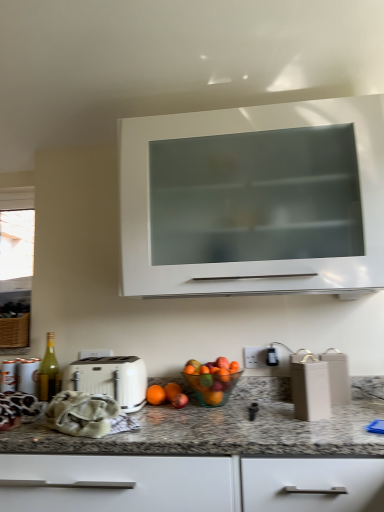
Question: Is green glass bottle at left outside granite at lower center?

Choices:
 (A) no
 (B) yes

Answer: (A)

Question: Is green glass bottle at left closer to the viewer compared to granite at lower center?

Choices:
 (A) yes
 (B) no

Answer: (B)

Question: Is green glass bottle at left oriented away from granite at lower center?

Choices:
 (A) yes
 (B) no

Answer: (B)

Question: Considering the relative sizes of green glass bottle at left and granite at lower center in the image provided, is green glass bottle at left smaller than granite at lower center?

Choices:
 (A) no
 (B) yes

Answer: (B)

Question: Is green glass bottle at left placed right next to granite at lower center?

Choices:
 (A) yes
 (B) no

Answer: (B)

Question: From a real-world perspective, relative to orange matte at center, is white glossy cabinet at upper center vertically above or below?

Choices:
 (A) above
 (B) below

Answer: (A)

Question: Choose the correct answer: Is white glossy cabinet at upper center inside orange matte at center or outside it?

Choices:
 (A) outside
 (B) inside

Answer: (A)

Question: From the image's perspective, is white glossy cabinet at upper center positioned above or below orange matte at center?

Choices:
 (A) below
 (B) above

Answer: (B)

Question: In the image, is white glossy cabinet at upper center on the left side or the right side of orange matte at center?

Choices:
 (A) right
 (B) left

Answer: (A)

Question: Is point (334, 205) closer or farther from the camera than point (34, 500)?

Choices:
 (A) farther
 (B) closer

Answer: (A)

Question: In terms of size, does white glossy cabinet at upper center appear bigger or smaller than granite at lower center?

Choices:
 (A) big
 (B) small

Answer: (B)

Question: In the image, is white glossy cabinet at upper center positioned in front of or behind granite at lower center?

Choices:
 (A) front
 (B) behind

Answer: (B)

Question: Considering the positions of white glossy cabinet at upper center and granite at lower center in the image, is white glossy cabinet at upper center wider or thinner than granite at lower center?

Choices:
 (A) wide
 (B) thin

Answer: (B)

Question: Considering their positions, is matte beige container at lower right located in front of or behind orange matte at center?

Choices:
 (A) front
 (B) behind

Answer: (A)

Question: Looking at their shapes, would you say matte beige container at lower right is wider or thinner than orange matte at center?

Choices:
 (A) thin
 (B) wide

Answer: (B)